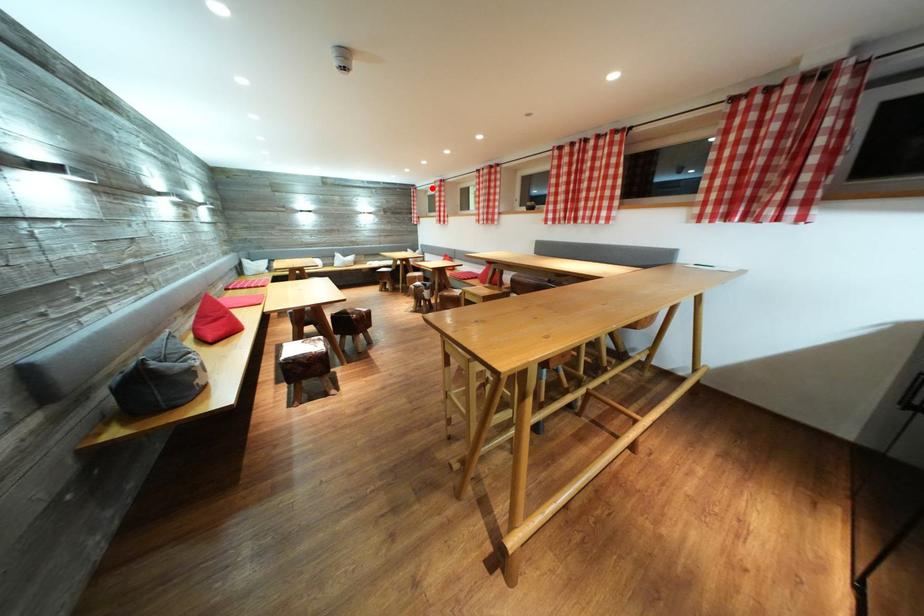
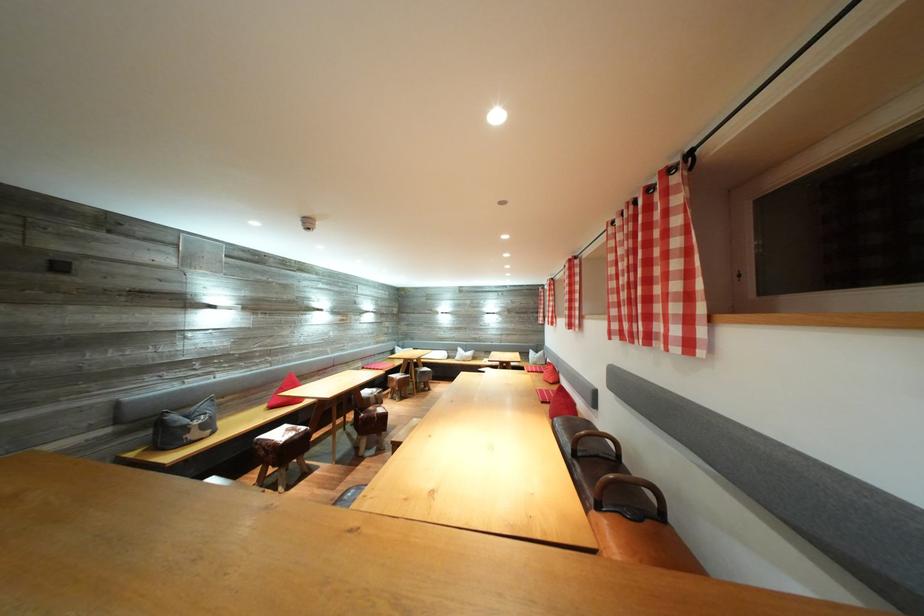
In the second image, find the point that corresponds to the highlighted location in the first image.

(553, 288)